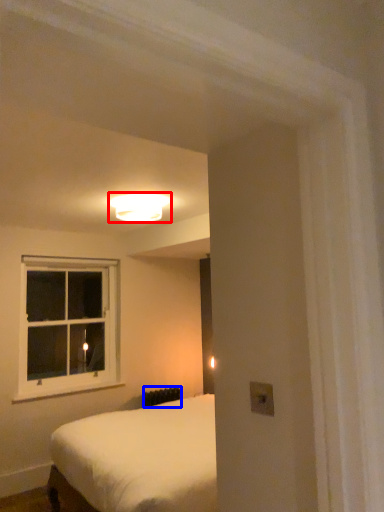
Question: Which object is closer to the camera taking this photo, lamp (highlighted by a red box) or radiator (highlighted by a blue box)?

Choices:
 (A) lamp
 (B) radiator

Answer: (A)